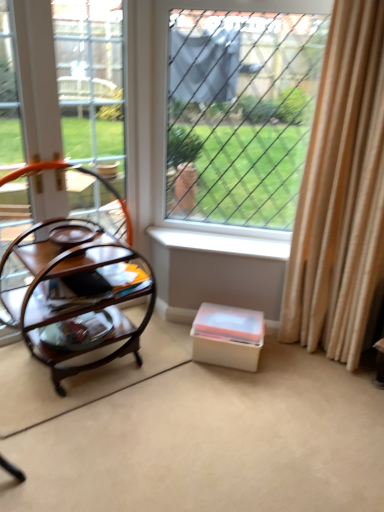
The height and width of the screenshot is (512, 384). I want to click on vacant space situated above white plastic window sill at center (from a real-world perspective), so click(220, 238).